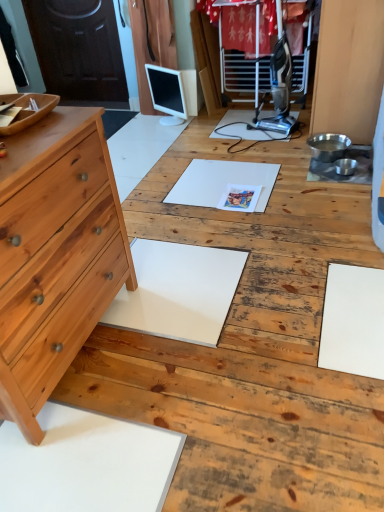
Question: From a real-world perspective, is white glossy computer monitor at center physically located above or below natural wood chest of drawers at left?

Choices:
 (A) below
 (B) above

Answer: (A)

Question: Is point (150, 71) positioned closer to the camera than point (39, 406)?

Choices:
 (A) farther
 (B) closer

Answer: (A)

Question: In terms of width, does white glossy computer monitor at center look wider or thinner when compared to natural wood chest of drawers at left?

Choices:
 (A) thin
 (B) wide

Answer: (A)

Question: From the image's perspective, is natural wood chest of drawers at left above or below white glossy computer monitor at center?

Choices:
 (A) above
 (B) below

Answer: (B)

Question: In terms of size, does natural wood chest of drawers at left appear bigger or smaller than white glossy computer monitor at center?

Choices:
 (A) small
 (B) big

Answer: (B)

Question: Is natural wood chest of drawers at left taller or shorter than white glossy computer monitor at center?

Choices:
 (A) short
 (B) tall

Answer: (B)

Question: Choose the correct answer: Is natural wood chest of drawers at left inside white glossy computer monitor at center or outside it?

Choices:
 (A) inside
 (B) outside

Answer: (B)